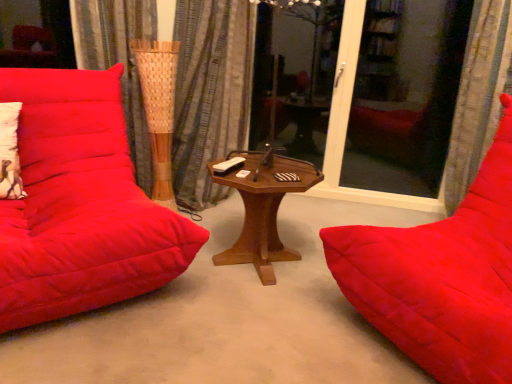
Question: Is wooden hexagonal table at center thinner than velvet red studio couch at right, which ranks as the first studio couch in right-to-left order?

Choices:
 (A) yes
 (B) no

Answer: (A)

Question: Considering the relative sizes of wooden hexagonal table at center and velvet red studio couch at right, which ranks as the first studio couch in right-to-left order, in the image provided, is wooden hexagonal table at center smaller than velvet red studio couch at right, which ranks as the first studio couch in right-to-left order,?

Choices:
 (A) no
 (B) yes

Answer: (B)

Question: Is wooden hexagonal table at center far from velvet red studio couch at right, which ranks as the first studio couch in right-to-left order?

Choices:
 (A) no
 (B) yes

Answer: (A)

Question: Considering the relative sizes of wooden hexagonal table at center and velvet red studio couch at right, the second studio couch positioned from the left, in the image provided, is wooden hexagonal table at center wider than velvet red studio couch at right, the second studio couch positioned from the left,?

Choices:
 (A) no
 (B) yes

Answer: (A)

Question: Is wooden hexagonal table at center in front of velvet red studio couch at right, the second studio couch positioned from the left?

Choices:
 (A) yes
 (B) no

Answer: (B)

Question: From a real-world perspective, is wooden hexagonal table at center on top of velvet red studio couch at right, which ranks as the first studio couch in right-to-left order?

Choices:
 (A) yes
 (B) no

Answer: (B)

Question: From a real-world perspective, does transparent glass screen door at right sit lower than textured fabric curtain at right, the 1th curtain in the right-to-left sequence?

Choices:
 (A) no
 (B) yes

Answer: (B)

Question: Can you confirm if transparent glass screen door at right is shorter than textured fabric curtain at right, the 1th curtain in the right-to-left sequence?

Choices:
 (A) yes
 (B) no

Answer: (B)

Question: Considering the relative positions of transparent glass screen door at right and textured fabric curtain at right, placed as the 2th curtain when sorted from left to right, in the image provided, is transparent glass screen door at right in front of textured fabric curtain at right, placed as the 2th curtain when sorted from left to right,?

Choices:
 (A) yes
 (B) no

Answer: (B)

Question: Can you confirm if transparent glass screen door at right is positioned to the left of textured fabric curtain at right, placed as the 2th curtain when sorted from left to right?

Choices:
 (A) no
 (B) yes

Answer: (B)

Question: Can you confirm if transparent glass screen door at right is smaller than textured fabric curtain at right, the 1th curtain in the right-to-left sequence?

Choices:
 (A) yes
 (B) no

Answer: (A)

Question: Can you confirm if transparent glass screen door at right is taller than textured fabric curtain at right, the 1th curtain in the right-to-left sequence?

Choices:
 (A) no
 (B) yes

Answer: (B)

Question: Is textured fabric curtain at right, placed as the 2th curtain when sorted from left to right, outside of transparent glass screen door at right?

Choices:
 (A) yes
 (B) no

Answer: (A)